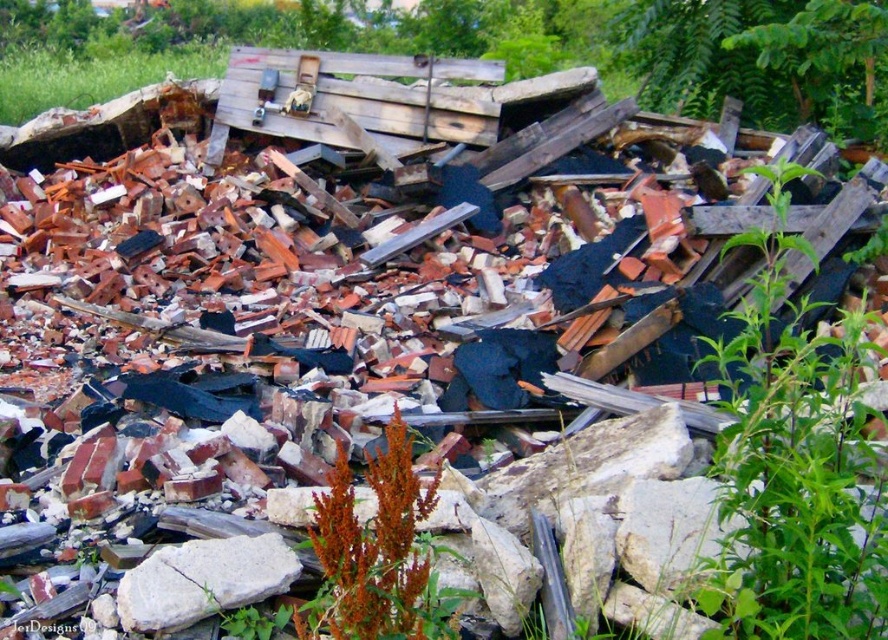
How much distance is there between brown fuzzy plant at center and white rough stone at center?

They are 16.34 inches apart.

Is brown fuzzy plant at center positioned behind white rough stone at center?

No.

The height and width of the screenshot is (640, 888). I want to click on brown fuzzy plant at center, so click(x=375, y=554).

Between green leafy plant at upper right and white rough stone at center, which one has more height?

Standing taller between the two is green leafy plant at upper right.

Identify the location of green leafy plant at upper right. (794, 470).

At what (x,y) coordinates should I click in order to perform the action: click on green leafy plant at upper right. Please return your answer as a coordinate pair (x, y). Looking at the image, I should click on (794, 470).

Can you confirm if green leafy plant at upper right is bigger than brown fuzzy plant at center?

Correct, green leafy plant at upper right is larger in size than brown fuzzy plant at center.

Can you confirm if green leafy plant at upper right is taller than brown fuzzy plant at center?

Correct, green leafy plant at upper right is much taller as brown fuzzy plant at center.

Is point (728, 317) positioned in front of point (397, 540)?

No, it is not.

Identify the location of green leafy plant at upper right. This screenshot has width=888, height=640. (794, 470).